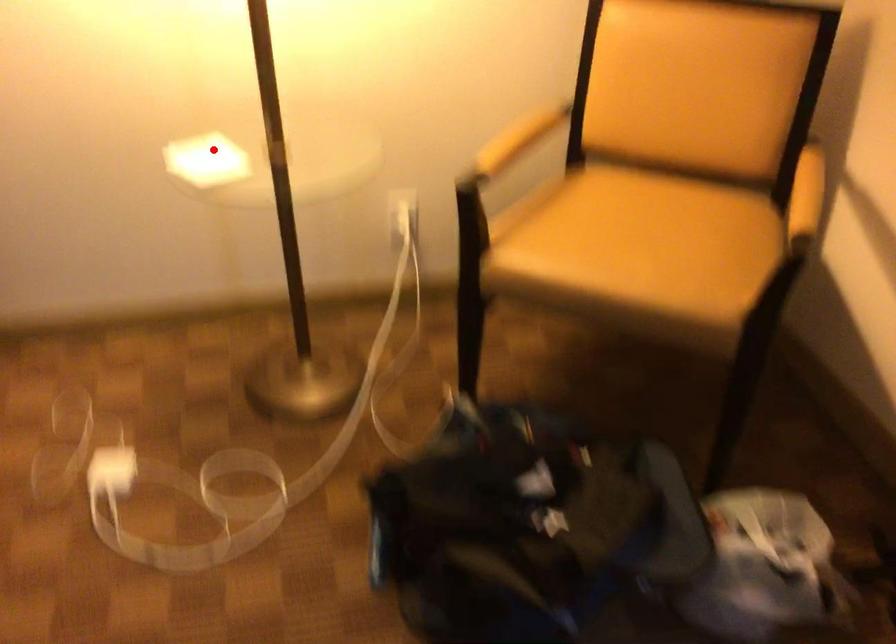
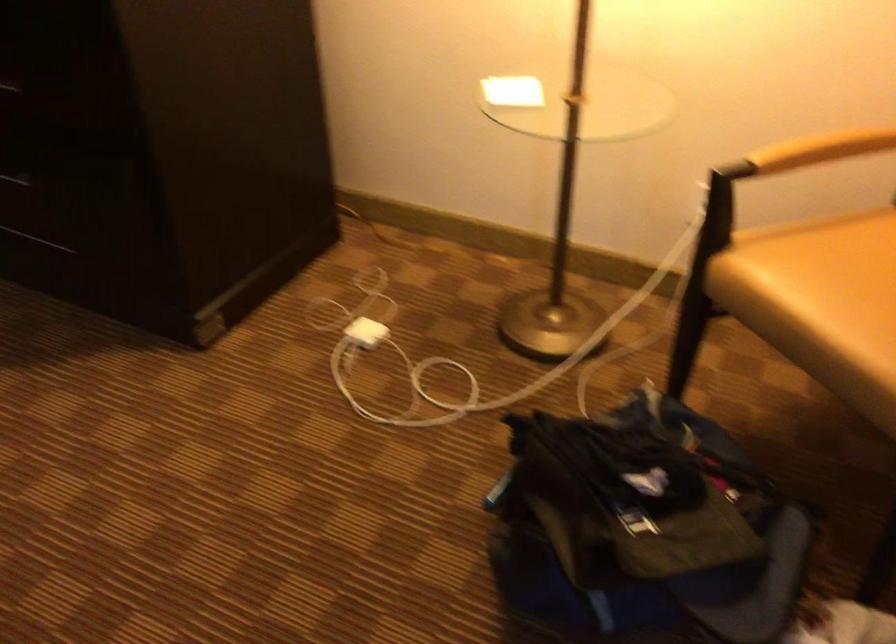
Question: I am providing you with two images of the same scene from different viewpoints. In image1, a red point is highlighted. Considering the same 3D point in image2, which of the following is correct?

Choices:
 (A) It is closer
 (B) It is farther

Answer: (B)